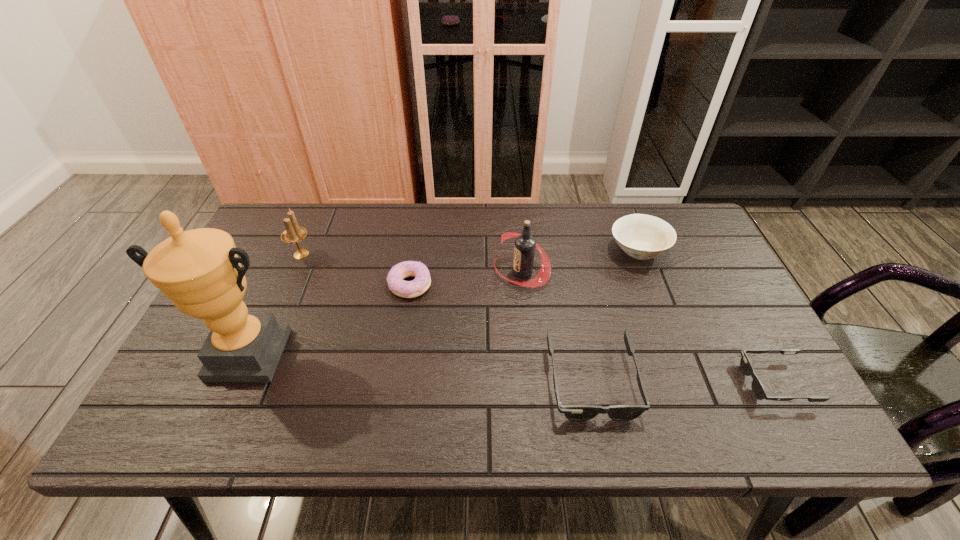
Find the location of `the left sunglasses`. the left sunglasses is located at coordinates (572, 412).

Find the location of `the third shortest object`. the third shortest object is located at coordinates (572, 412).

Identify the location of the shortest object. This screenshot has height=540, width=960. point(758,389).

Identify the location of the right sunglasses. The height and width of the screenshot is (540, 960). (758, 389).

Image resolution: width=960 pixels, height=540 pixels. I want to click on root beer, so click(x=524, y=250).

At what (x,y) coordinates should I click in order to perform the action: click on candle holder. Please return your answer as a coordinate pair (x, y). The width and height of the screenshot is (960, 540). Looking at the image, I should click on (293, 234).

Identify the location of the fourth shortest object. (641, 236).

At what (x,y) coordinates should I click in order to perform the action: click on bowl. Please return your answer as a coordinate pair (x, y). The width and height of the screenshot is (960, 540). Looking at the image, I should click on (641, 236).

This screenshot has height=540, width=960. Find the location of `the tallest object`. the tallest object is located at coordinates (199, 270).

Where is `the fifth object from right to left`? The height and width of the screenshot is (540, 960). the fifth object from right to left is located at coordinates click(406, 289).